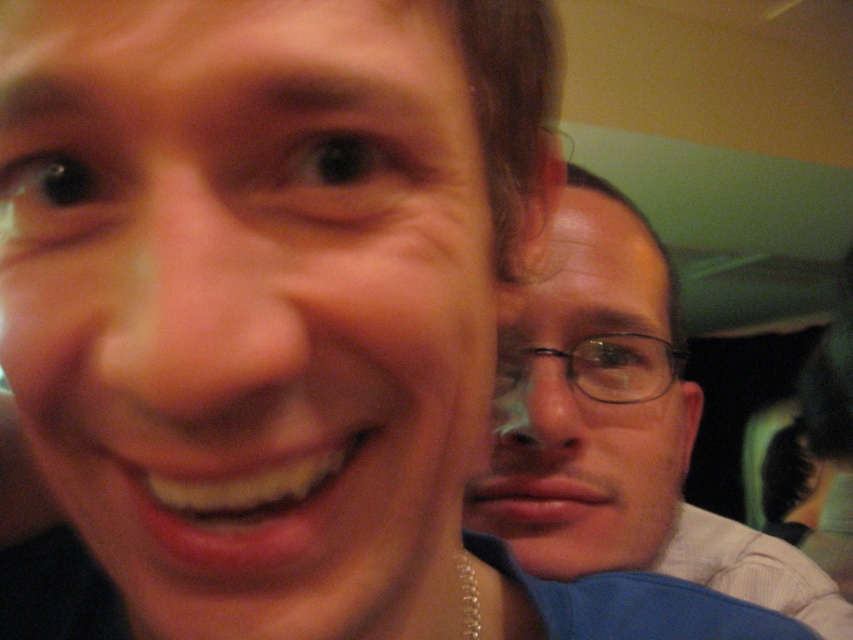
Question: Does matte black glasses at center have a lesser width compared to black plastic glasses at right?

Choices:
 (A) no
 (B) yes

Answer: (A)

Question: Which point is farther to the camera?

Choices:
 (A) (566, 371)
 (B) (453, 493)
 (C) (607, 364)

Answer: (C)

Question: Is matte black glasses at upper right wider than matte black glasses at center?

Choices:
 (A) yes
 (B) no

Answer: (A)

Question: Among these points, which one is farthest from the camera?

Choices:
 (A) (648, 260)
 (B) (250, 81)

Answer: (A)

Question: Is matte black glasses at center further to the viewer compared to black plastic glasses at right?

Choices:
 (A) yes
 (B) no

Answer: (B)

Question: Which of these objects is positioned closest to the black plastic glasses at right?

Choices:
 (A) matte black glasses at upper right
 (B) matte black glasses at center

Answer: (B)